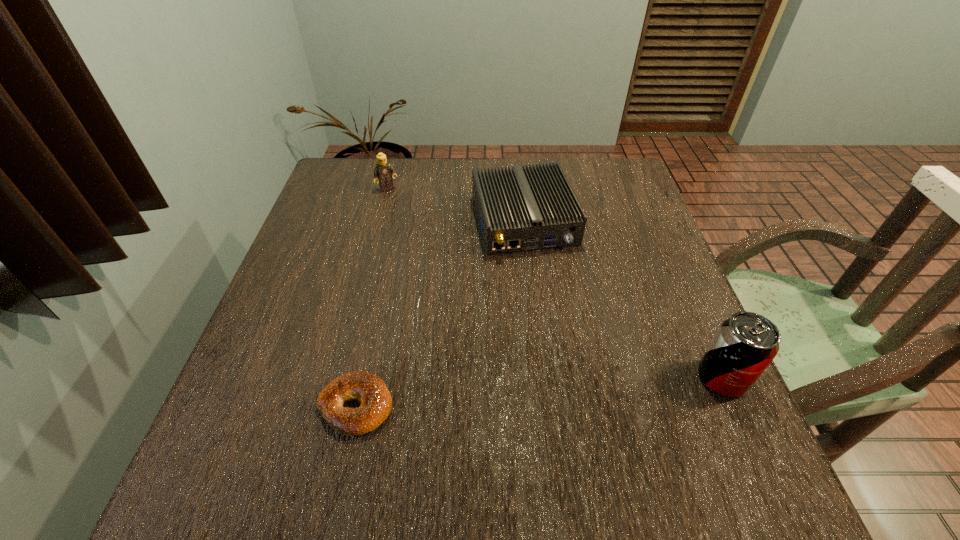
Locate an element on the screen. vacant area between the router and the rightmost object is located at coordinates (623, 300).

Where is `free space that is in between the shortest object and the tallest object`? This screenshot has height=540, width=960. free space that is in between the shortest object and the tallest object is located at coordinates (540, 392).

You are a GUI agent. You are given a task and a screenshot of the screen. Output one action in this format:
    pyautogui.click(x=<x>, y=<y>)
    Task: Click on the blank region between the Lego and the shortest object
    The width and height of the screenshot is (960, 540).
    Given the screenshot: What is the action you would take?
    pyautogui.click(x=372, y=298)

This screenshot has width=960, height=540. I want to click on vacant area between the third shortest object and the bagel, so click(x=372, y=298).

Where is `vacant region between the shortest object and the third tallest object`? This screenshot has height=540, width=960. vacant region between the shortest object and the third tallest object is located at coordinates (440, 314).

In order to click on vacant area that lies between the router and the bagel in this screenshot , I will do `click(440, 314)`.

This screenshot has width=960, height=540. What are the coordinates of `vacant space that's between the Lego and the router` in the screenshot? It's located at (456, 205).

This screenshot has width=960, height=540. Find the location of `object identified as the closest to the third shortest object`. object identified as the closest to the third shortest object is located at coordinates (535, 208).

Image resolution: width=960 pixels, height=540 pixels. What are the coordinates of `object that is the closest to the shortest object` in the screenshot? It's located at (535, 208).

Locate an element on the screen. Image resolution: width=960 pixels, height=540 pixels. free spot that satisfies the following two spatial constraints: 1. on the front side of the Lego; 2. on the left side of the bagel is located at coordinates (331, 407).